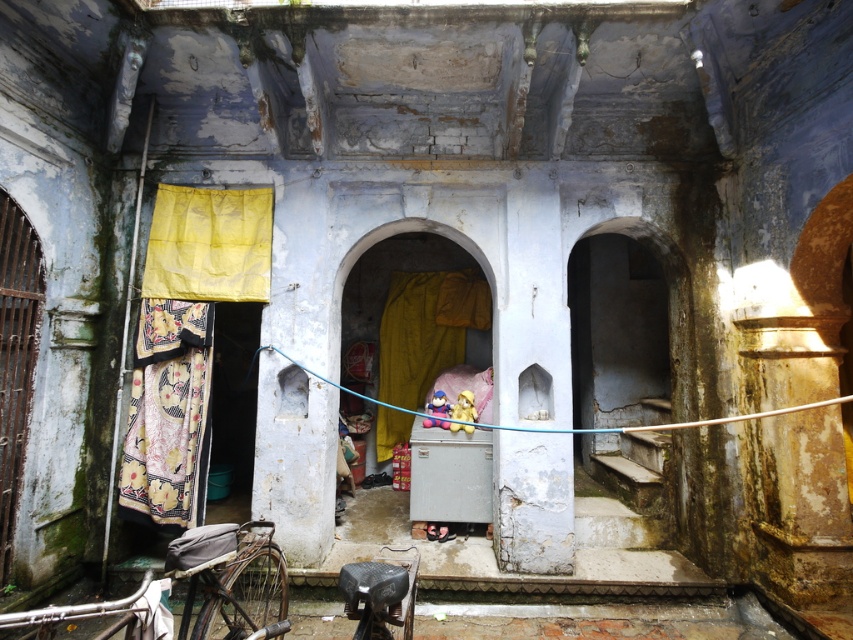
Does printed fabric laundry at left lie in front of metallic silver bicycle at lower left?

No.

Does printed fabric laundry at left have a smaller size compared to metallic silver bicycle at lower left?

Indeed, printed fabric laundry at left has a smaller size compared to metallic silver bicycle at lower left.

Find the location of a particular element. This screenshot has height=640, width=853. printed fabric laundry at left is located at coordinates (167, 410).

How much distance is there between printed fabric laundry at left and yellow fabric at center?

printed fabric laundry at left is 3.27 meters away from yellow fabric at center.

Can you confirm if printed fabric laundry at left is smaller than yellow fabric at center?

Correct, printed fabric laundry at left occupies less space than yellow fabric at center.

At what (x,y) coordinates should I click in order to perform the action: click on printed fabric laundry at left. Please return your answer as a coordinate pair (x, y). Looking at the image, I should click on (167, 410).

Who is positioned more to the right, yellow fabric at center or metallic silver bicycle at lower left?

yellow fabric at center

Which of these two, yellow fabric at center or metallic silver bicycle at lower left, stands taller?

yellow fabric at center is taller.

The image size is (853, 640). Describe the element at coordinates (427, 330) in the screenshot. I see `yellow fabric at center` at that location.

Identify the location of yellow fabric at center. (427, 330).